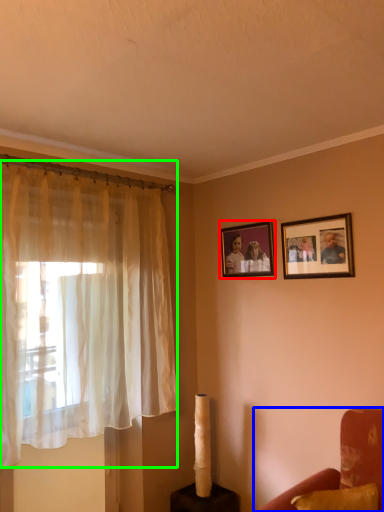
Question: Based on their relative distances, which object is nearer to picture frame (highlighted by a red box)? Choose from furniture (highlighted by a blue box) and curtain (highlighted by a green box).

Choices:
 (A) furniture
 (B) curtain

Answer: (B)